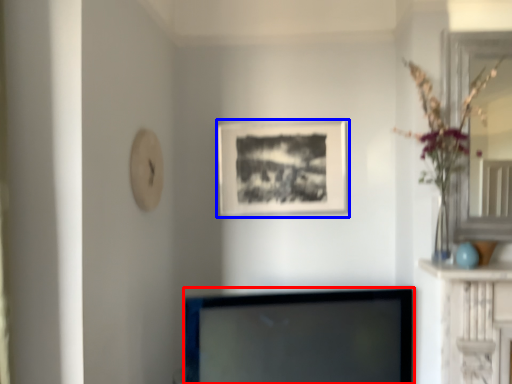
Question: Which of the following is the farthest to the observer, television (highlighted by a red box) or picture frame (highlighted by a blue box)?

Choices:
 (A) television
 (B) picture frame

Answer: (B)